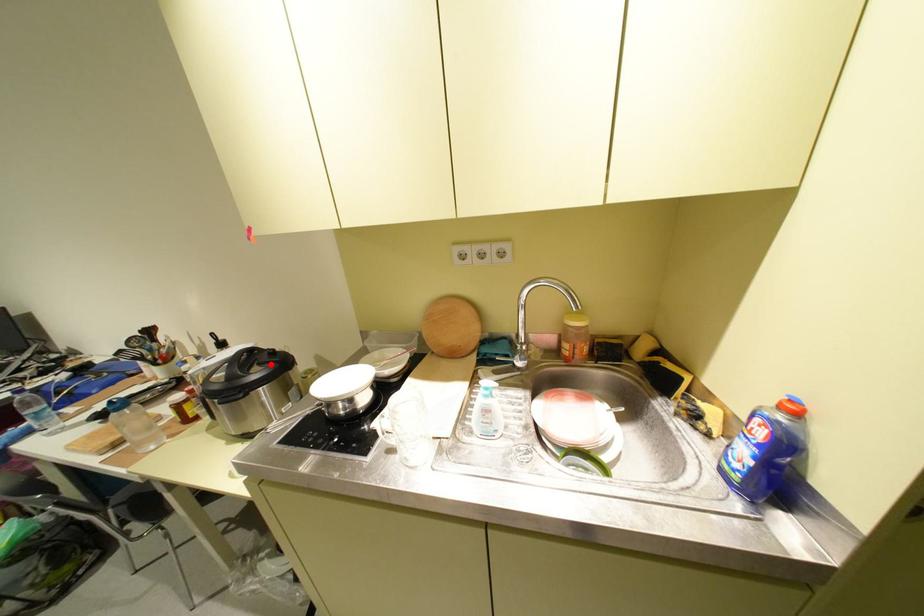
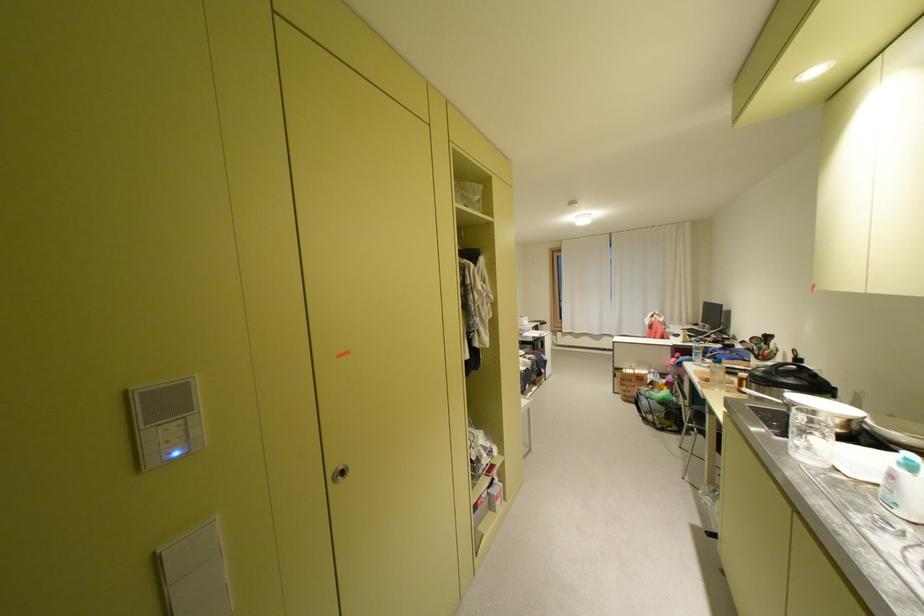
The point at the highlighted location is marked in the first image. Where is the corresponding point in the second image?

(808, 378)